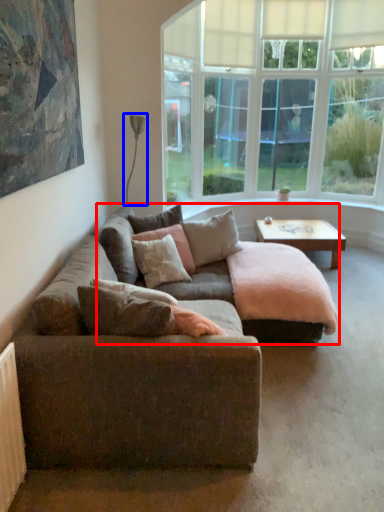
Question: Which of the following is the farthest to the observer, couch (highlighted by a red box) or lamp (highlighted by a blue box)?

Choices:
 (A) couch
 (B) lamp

Answer: (B)